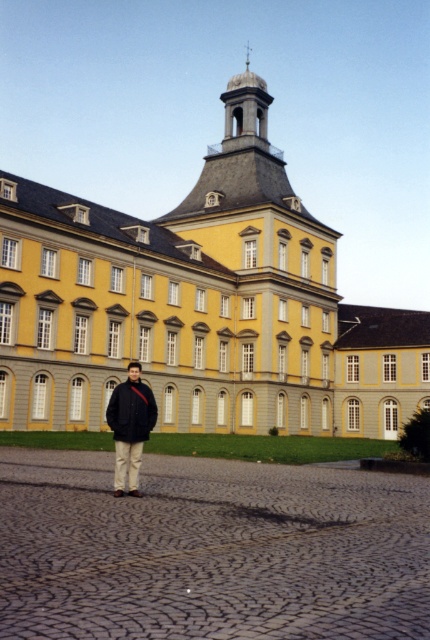
Which is more to the right, yellow matte building at center or dark blue woolen jacket at center?

From the viewer's perspective, yellow matte building at center appears more on the right side.

Which is more to the left, yellow matte building at center or dark blue woolen jacket at center?

Positioned to the left is dark blue woolen jacket at center.

Between point (205, 337) and point (137, 420), which one is positioned behind?

The point (205, 337) is more distant.

Locate an element on the screen. yellow matte building at center is located at coordinates (199, 305).

Is yellow matte building at center positioned behind dark gray fabric jacket at center?

Yes, yellow matte building at center is further from the viewer.

Does point (97, 243) come behind point (137, 458)?

Yes, it is.

What do you see at coordinates (199, 305) in the screenshot? I see `yellow matte building at center` at bounding box center [199, 305].

Identify the location of yellow matte building at center. The height and width of the screenshot is (640, 430). (199, 305).

Can you confirm if dark gray fabric jacket at center is taller than dark blue woolen jacket at center?

Yes, dark gray fabric jacket at center is taller than dark blue woolen jacket at center.

Can you confirm if dark gray fabric jacket at center is positioned to the left of dark blue woolen jacket at center?

No, dark gray fabric jacket at center is not to the left of dark blue woolen jacket at center.

Who is more forward, (132, 481) or (132, 396)?

Point (132, 481) is in front.

Find the location of `dark gray fabric jacket at center`. dark gray fabric jacket at center is located at coordinates [129, 426].